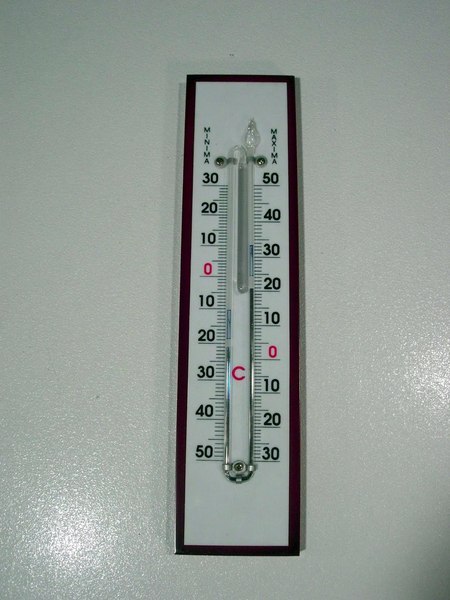
Identify the location of frame. Image resolution: width=450 pixels, height=600 pixels. [x=295, y=506].